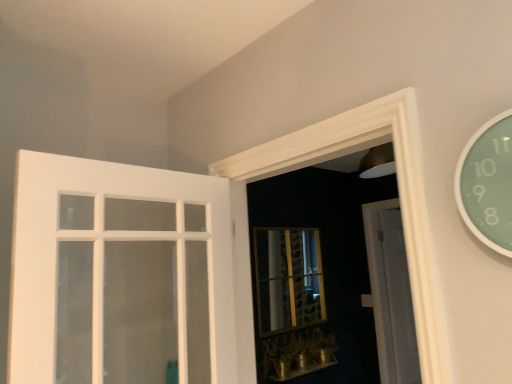
Question: Is metallic gold window sill at lower center taller or shorter than white wood door at center, which is the first door in back-to-front order?

Choices:
 (A) short
 (B) tall

Answer: (A)

Question: Is point (314, 357) closer or farther from the camera than point (393, 311)?

Choices:
 (A) closer
 (B) farther

Answer: (A)

Question: Considering the real-world distances, which object is closest to the metallic gold window sill at lower center?

Choices:
 (A) white painted wood door at left, which ranks as the 2th door in back-to-front order
 (B) gold textured glass bay window at center
 (C) white wood door at center, marked as the 2th door in a front-to-back arrangement
 (D) green glass clock at upper right

Answer: (B)

Question: Considering the real-world distances, which object is farthest from the gold textured glass bay window at center?

Choices:
 (A) green glass clock at upper right
 (B) white wood door at center, which is the first door in back-to-front order
 (C) white painted wood door at left, acting as the 1th door starting from the front
 (D) metallic gold window sill at lower center

Answer: (A)